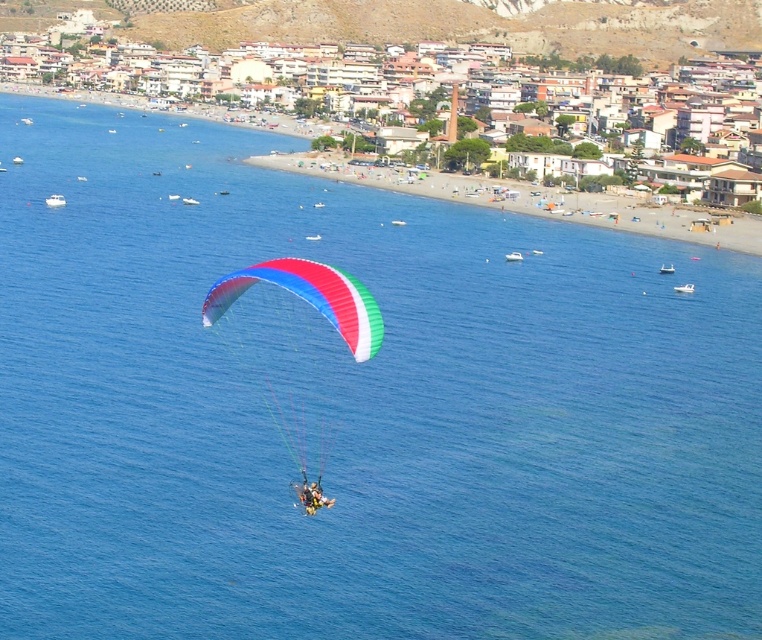
Question: Which of the following is the farthest from the observer?

Choices:
 (A) multicolored fabric parachute at center
 (B) yellow fabric parachute at center

Answer: (A)

Question: Is multicolored fabric parachute at center smaller than yellow fabric parachute at center?

Choices:
 (A) no
 (B) yes

Answer: (A)

Question: Which point is farther to the camera?

Choices:
 (A) yellow fabric parachute at center
 (B) multicolored fabric parachute at center

Answer: (B)

Question: Can you confirm if multicolored fabric parachute at center is thinner than yellow fabric parachute at center?

Choices:
 (A) yes
 (B) no

Answer: (B)

Question: Is multicolored fabric parachute at center smaller than yellow fabric parachute at center?

Choices:
 (A) no
 (B) yes

Answer: (A)